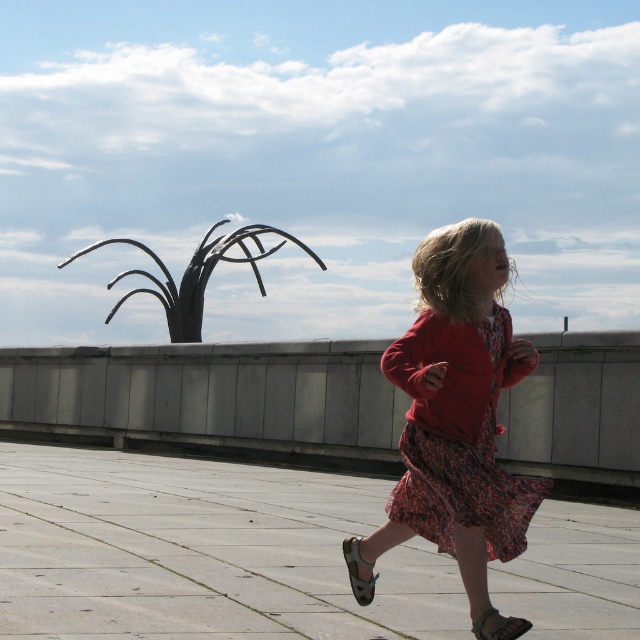
Question: Is floral cotton dress at center to the left of black metal sculpture at upper center from the viewer's perspective?

Choices:
 (A) yes
 (B) no

Answer: (B)

Question: Does smooth concrete pavement at center appear over black metal sculpture at upper center?

Choices:
 (A) yes
 (B) no

Answer: (B)

Question: Which point is farther from the camera taking this photo?

Choices:
 (A) (204, 285)
 (B) (524, 566)

Answer: (A)

Question: Which object is the farthest from the floral cotton dress at center?

Choices:
 (A) smooth concrete pavement at center
 (B) black metal sculpture at upper center

Answer: (B)

Question: Which of the following is the closest to the observer?

Choices:
 (A) smooth concrete pavement at center
 (B) black metal sculpture at upper center

Answer: (A)

Question: Does floral cotton dress at center appear on the left side of black metal sculpture at upper center?

Choices:
 (A) no
 (B) yes

Answer: (A)